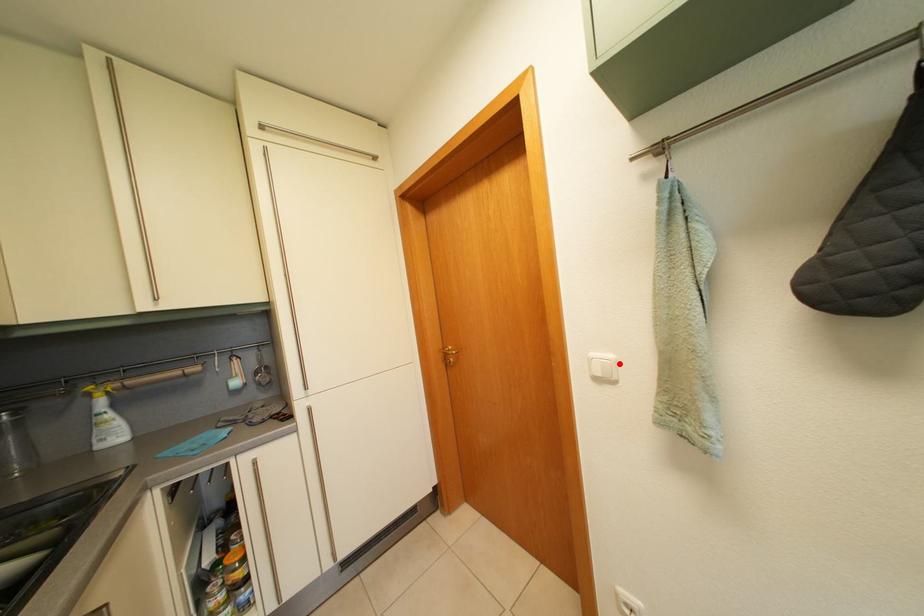
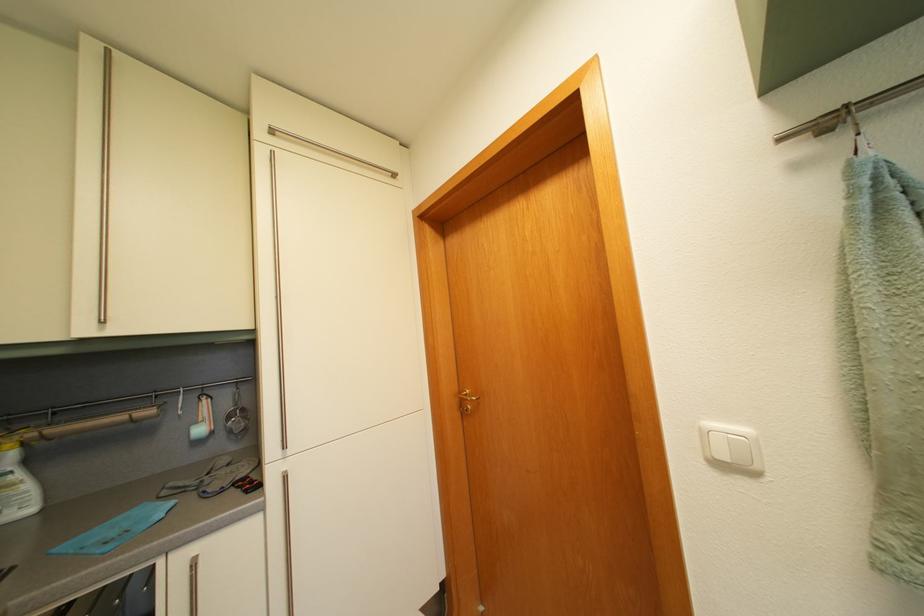
The point at the highlighted location is marked in the first image. Where is the corresponding point in the second image?

(755, 438)